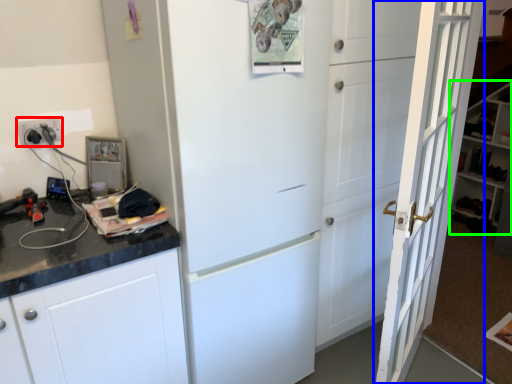
Question: Which object is the farthest from electric outlet (highlighted by a red box)? Choose among these: door (highlighted by a blue box) or bookshelf (highlighted by a green box).

Choices:
 (A) door
 (B) bookshelf

Answer: (B)